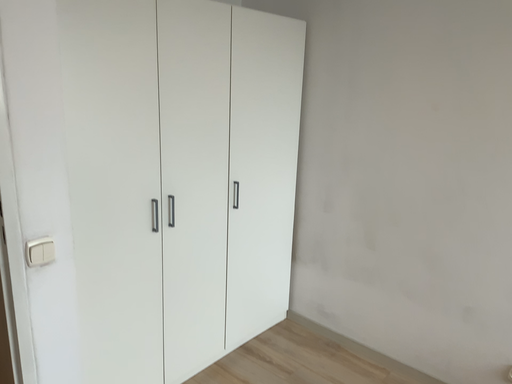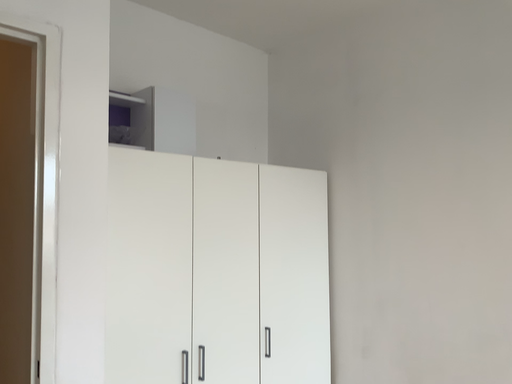
Question: Which way did the camera rotate in the video?

Choices:
 (A) rotated upward
 (B) rotated downward

Answer: (A)